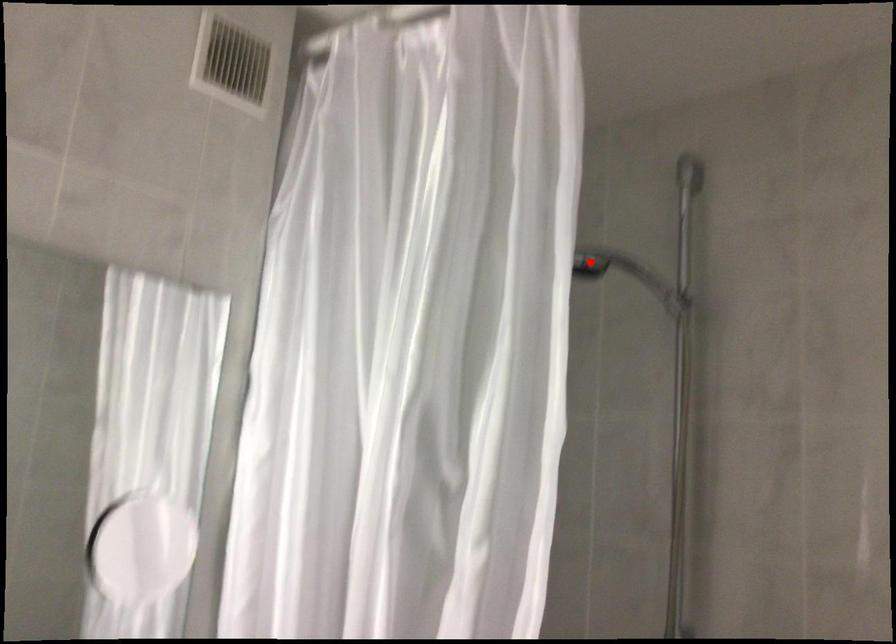
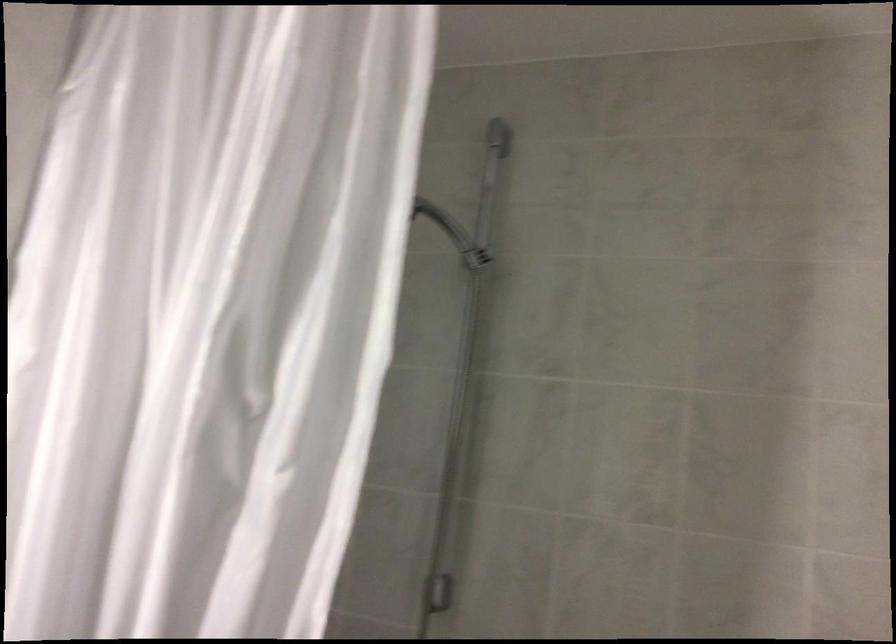
Question: I am providing you with two images of the same scene from different viewpoints. A red point is marked on the first image. Can you still see the location of the red point in image 2?

Choices:
 (A) Yes
 (B) No

Answer: (B)